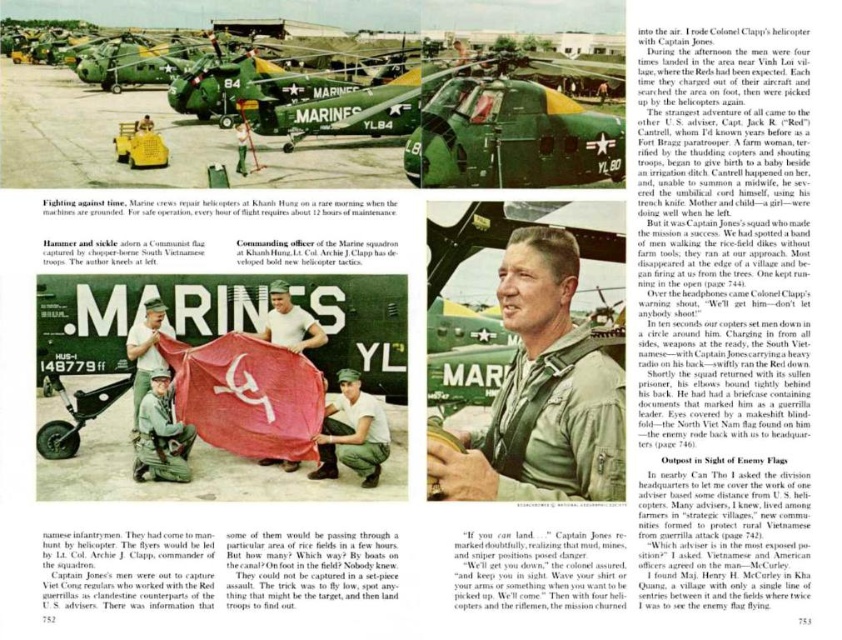
Describe the element at coordinates (542, 392) in the screenshot. I see `green military uniform at center` at that location.

Is point (601, 435) behind point (530, 60)?

That is False.

The image size is (842, 640). I want to click on green military uniform at center, so click(542, 392).

Does green military uniform at center appear over green camouflage uniform at center?

Actually, green military uniform at center is below green camouflage uniform at center.

Does green military uniform at center appear on the left side of green camouflage uniform at center?

In fact, green military uniform at center is to the right of green camouflage uniform at center.

Which is in front, point (550, 442) or point (160, 314)?

Point (550, 442) is in front.

You are a GUI agent. You are given a task and a screenshot of the screen. Output one action in this format:
    pyautogui.click(x=<x>, y=<y>)
    Task: Click on the green military uniform at center
    
    Given the screenshot: What is the action you would take?
    pyautogui.click(x=542, y=392)

Can you confirm if camouflage uniform at center is smaller than white cotton shirt at center?

No.

Does camouflage uniform at center appear under white cotton shirt at center?

Indeed, camouflage uniform at center is positioned under white cotton shirt at center.

Where is `camouflage uniform at center`? camouflage uniform at center is located at coordinates (352, 433).

At what (x,y) coordinates should I click in order to perform the action: click on camouflage uniform at center. Please return your answer as a coordinate pair (x, y). The height and width of the screenshot is (640, 842). Looking at the image, I should click on (352, 433).